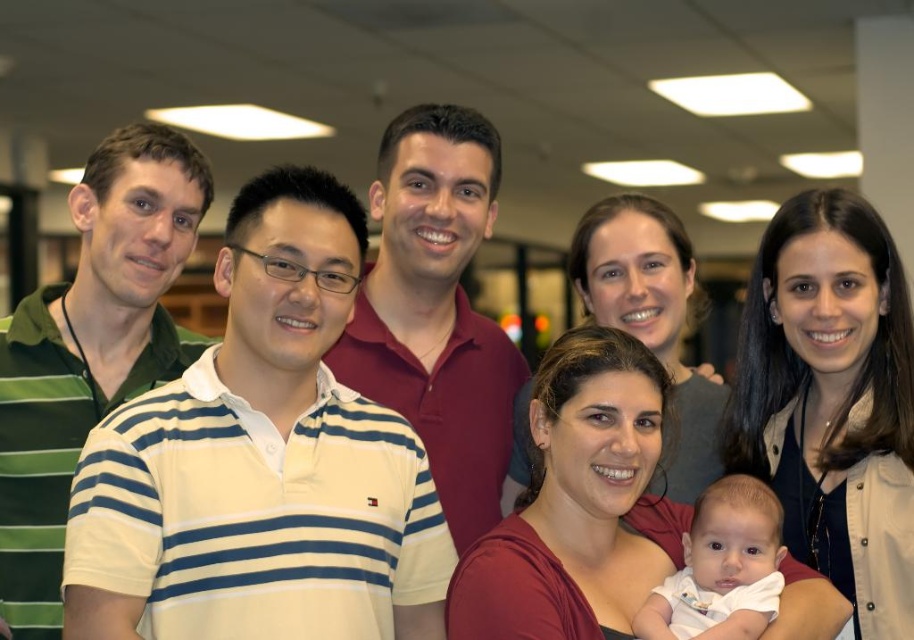
What do you see at coordinates (90, 349) in the screenshot? I see `green striped polo shirt at left` at bounding box center [90, 349].

Which is behind, point (44, 548) or point (692, 522)?

The point (44, 548) is behind.

This screenshot has width=914, height=640. Find the location of `green striped polo shirt at left`. green striped polo shirt at left is located at coordinates (90, 349).

Which is more to the left, striped cotton polo shirt at center or white soft baby at center?

Positioned to the left is striped cotton polo shirt at center.

Who is positioned more to the right, striped cotton polo shirt at center or white soft baby at center?

From the viewer's perspective, white soft baby at center appears more on the right side.

What are the coordinates of `striped cotton polo shirt at center` in the screenshot? It's located at (261, 461).

Can you confirm if green striped polo shirt at left is shorter than maroon cotton polo shirt at center?

Incorrect, green striped polo shirt at left's height does not fall short of maroon cotton polo shirt at center's.

Is green striped polo shirt at left below maroon cotton polo shirt at center?

Yes, green striped polo shirt at left is below maroon cotton polo shirt at center.

Locate an element on the screen. The image size is (914, 640). green striped polo shirt at left is located at coordinates (90, 349).

Find the location of a particular element. This screenshot has width=914, height=640. green striped polo shirt at left is located at coordinates (90, 349).